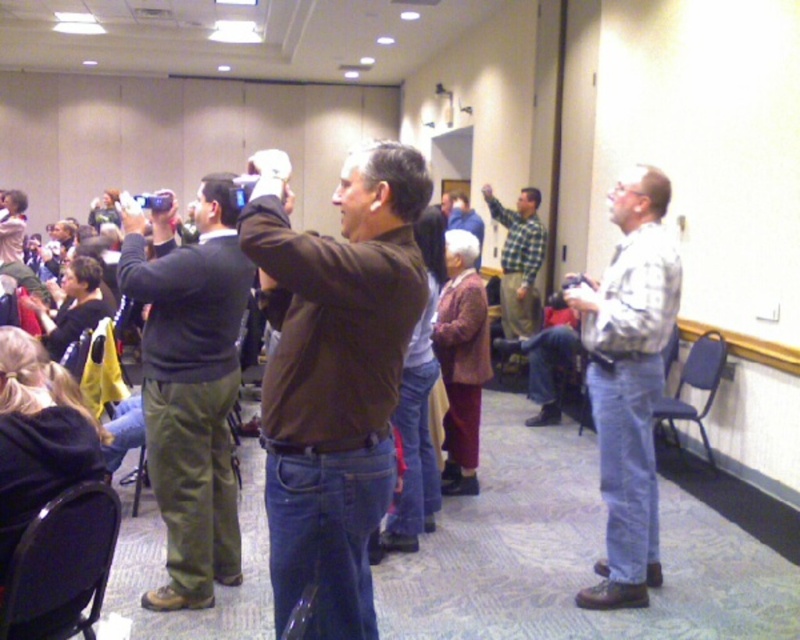
You are standing in the conference room and see the point marked at coordinates (190, 385). What object is located at that point?

The point at coordinates (190, 385) marks dark green pants at center.

You are attending a presentation and notice two people at the center of the image. One is wearing dark green pants at center and the other has a checkered fabric shirt at center. From your perspective, which person is closer to you?

The dark green pants at center is in front of the checkered fabric shirt at center, so the person wearing dark green pants at center is closer to you.